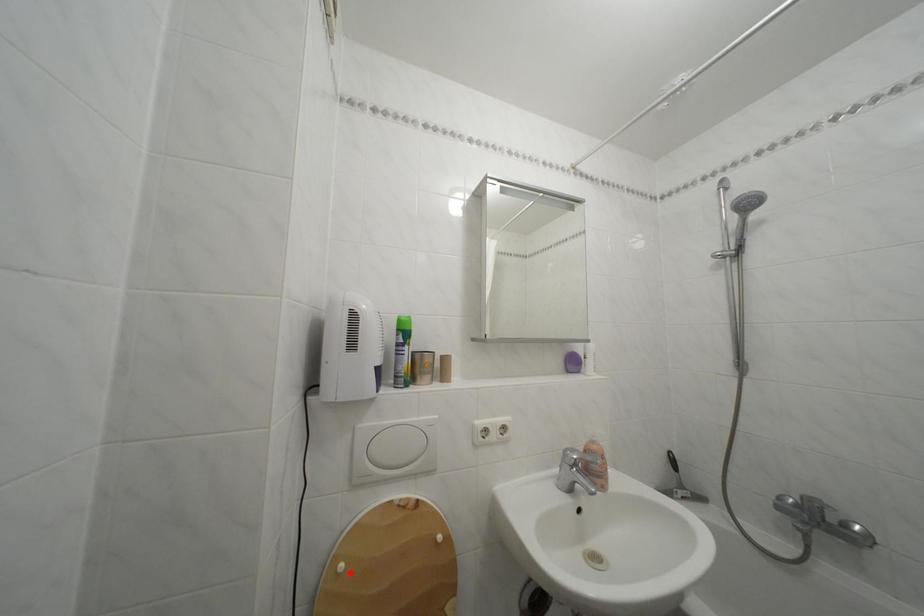
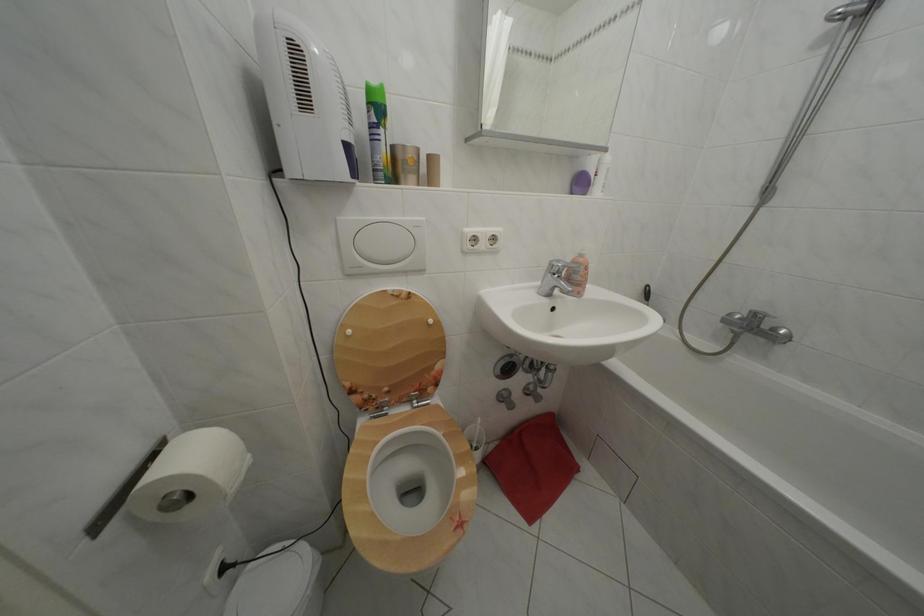
Where in the second image is the point corresponding to the highlighted location from the first image?

(358, 338)